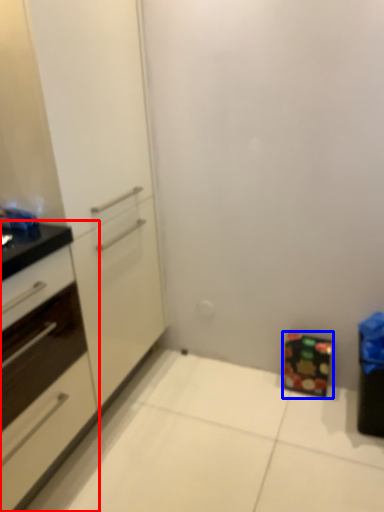
Question: Which object appears farthest to the camera in this image, cabinetry (highlighted by a red box) or cabinetry (highlighted by a blue box)?

Choices:
 (A) cabinetry
 (B) cabinetry

Answer: (B)